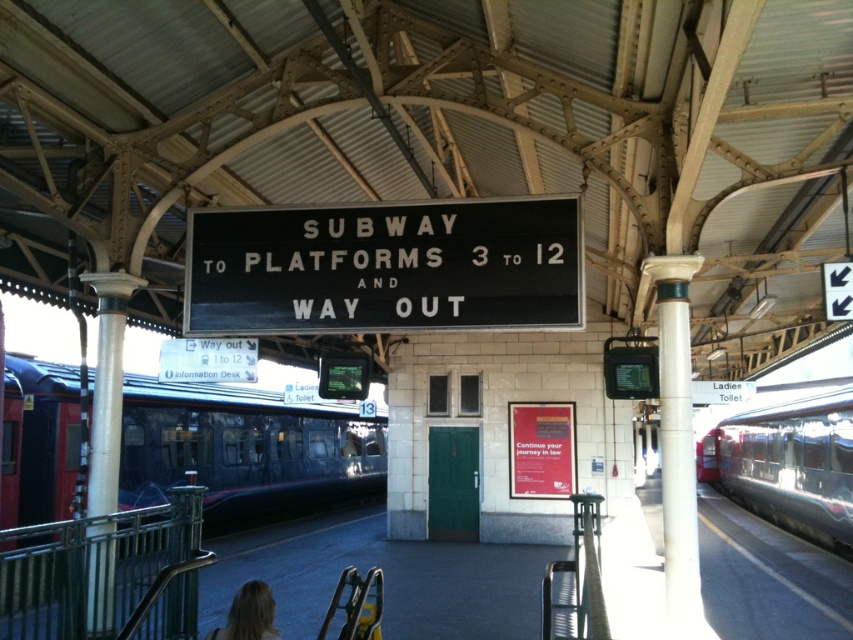
You are standing on the subway platform and see both the dark blue metallic train at left and the polished stainless steel train at right. Which train is nearer to you?

The dark blue metallic train at left is closer to you than the polished stainless steel train at right.

You are a passenger at the train station and want to board the train that is closest to the information desk. Which train should you go to, the dark blue metallic train at left or the polished stainless steel train at right?

The dark blue metallic train at left is positioned on the left side of the polished stainless steel train at right. Since the information desk is mentioned in the signage below the main sign, it is likely located near the center of the platform. The dark blue metallic train at left is closer to the center, so you should go to the dark blue metallic train at left.